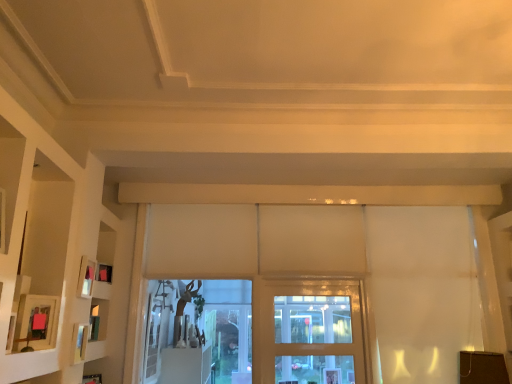
Question: Does clear glass door at center contain matte black picture frame at left, the 1th picture frame when ordered from back to front?

Choices:
 (A) yes
 (B) no

Answer: (B)

Question: From the image's perspective, is clear glass door at center located beneath matte black picture frame at left, the 1th picture frame when ordered from back to front?

Choices:
 (A) no
 (B) yes

Answer: (B)

Question: Is clear glass door at center positioned beyond the bounds of matte black picture frame at left, the 1th picture frame when ordered from back to front?

Choices:
 (A) no
 (B) yes

Answer: (B)

Question: Can you confirm if clear glass door at center is taller than matte black picture frame at left, arranged as the third picture frame when viewed from the front?

Choices:
 (A) no
 (B) yes

Answer: (B)

Question: Considering the relative positions of clear glass door at center and matte black picture frame at left, the 1th picture frame when ordered from back to front, in the image provided, is clear glass door at center to the left of matte black picture frame at left, the 1th picture frame when ordered from back to front, from the viewer's perspective?

Choices:
 (A) no
 (B) yes

Answer: (A)

Question: Is clear glass door at center oriented away from matte black picture frame at left, the 1th picture frame when ordered from back to front?

Choices:
 (A) yes
 (B) no

Answer: (B)

Question: Is matte wooden picture frame at left, the second picture frame from the back, outside clear glass door at center?

Choices:
 (A) no
 (B) yes

Answer: (B)

Question: Are matte wooden picture frame at left, the second picture frame from the back, and clear glass door at center located far from each other?

Choices:
 (A) yes
 (B) no

Answer: (A)

Question: Considering the relative sizes of matte wooden picture frame at left, the second picture frame from the back, and clear glass door at center in the image provided, is matte wooden picture frame at left, the second picture frame from the back, thinner than clear glass door at center?

Choices:
 (A) yes
 (B) no

Answer: (A)

Question: Can you confirm if matte wooden picture frame at left, the second picture frame from the back, is bigger than clear glass door at center?

Choices:
 (A) yes
 (B) no

Answer: (B)

Question: Is matte wooden picture frame at left, the second picture frame from the back, shorter than clear glass door at center?

Choices:
 (A) no
 (B) yes

Answer: (B)

Question: Can you confirm if matte wooden picture frame at left, the second picture frame from the back, is wider than clear glass door at center?

Choices:
 (A) yes
 (B) no

Answer: (B)

Question: Is matte pink picture frame at left, the first picture frame positioned from the front, with white matte shelf at left?

Choices:
 (A) yes
 (B) no

Answer: (B)